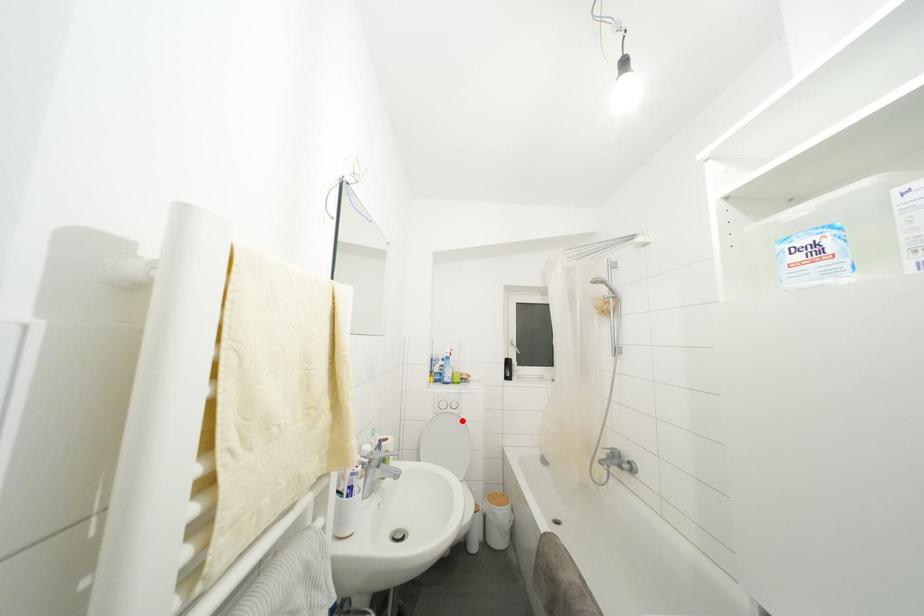
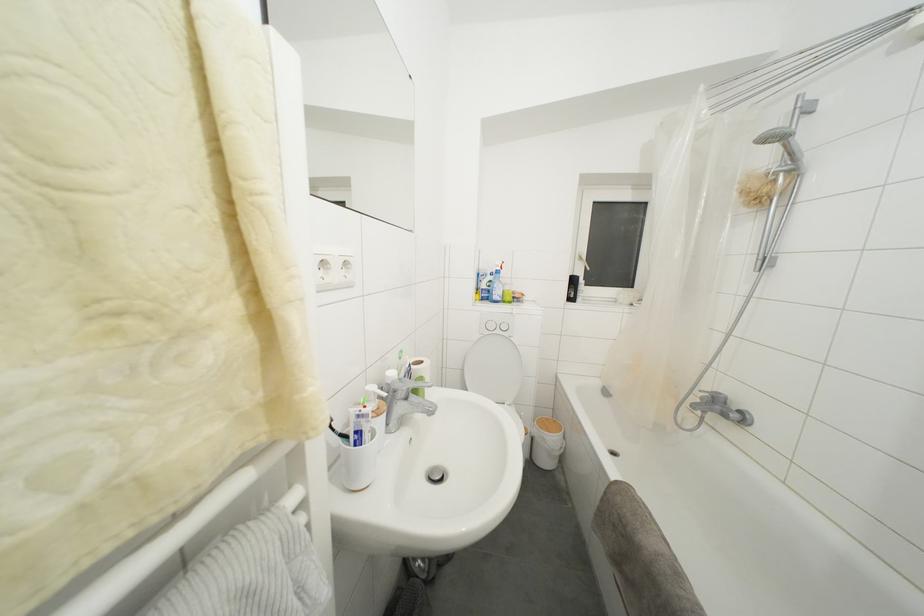
Question: I am providing you with two images of the same scene from different viewpoints. Given a red point in image1, look at the same physical point in image2. Is it:

Choices:
 (A) Closer to the viewpoint
 (B) Farther from the viewpoint

Answer: (A)